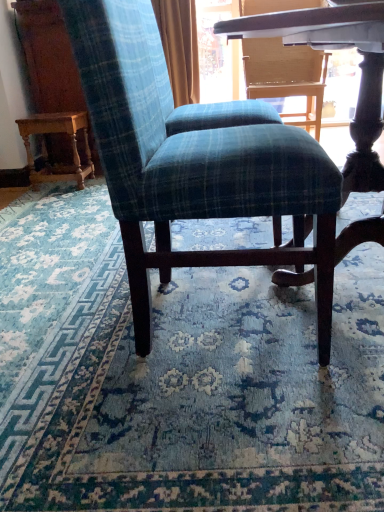
Image resolution: width=384 pixels, height=512 pixels. I want to click on vacant region above blue plaid fabric at center (from a real-world perspective), so click(125, 292).